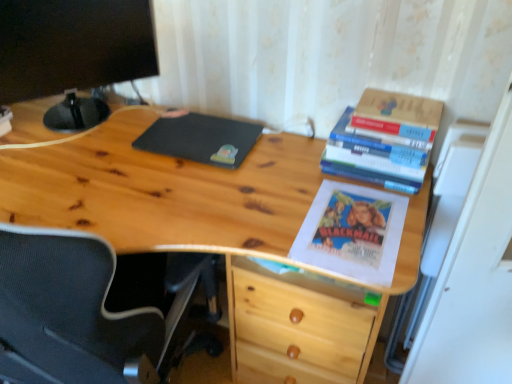
Identify the location of vacant area that lies between black matte computer monitor at upper left and black matte mousepad at center. This screenshot has height=384, width=512. (106, 147).